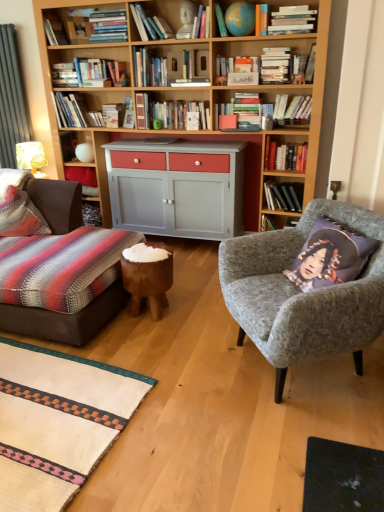
What are the coordinates of `vacant area on top of hardcover books at upper right, the 13th book from the left (from a real-world perspective)` in the screenshot? It's located at (296, 139).